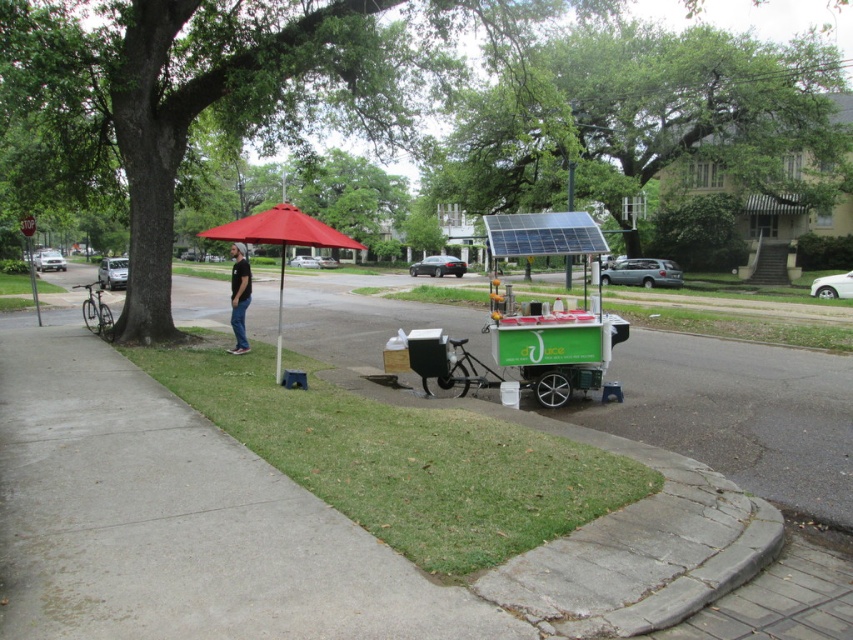
You are a delivery person who needs to park your bike near the red fabric umbrella at center. The parking spot is at coordinates 0.375, 0.331. Can you park your bike there?

The red fabric umbrella at center is located at coordinates (281, 240), so yes, you can park your bike there as the parking spot matches the umbrella location.

You are a customer wanting to buy juice from the cart. You notice the red fabric umbrella at center and the black cotton shirt at center. Which object is wider when viewed from above?

The red fabric umbrella at center is wider than the black cotton shirt at center when viewed from above.